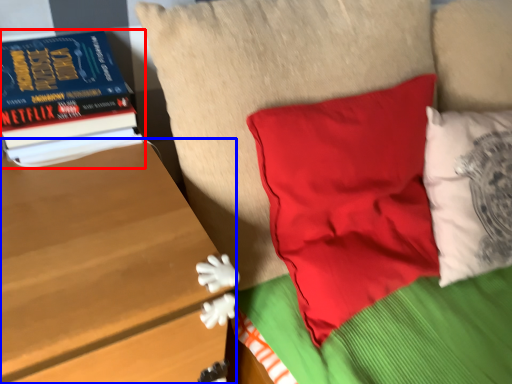
Question: Which point is further to the camera, book (highlighted by a red box) or table (highlighted by a blue box)?

Choices:
 (A) book
 (B) table

Answer: (A)